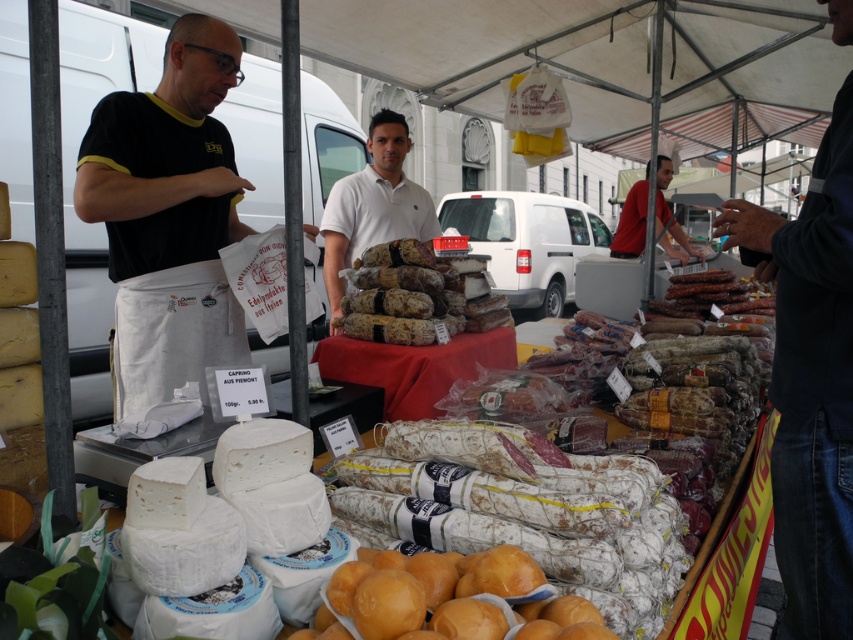
Question: Which of these objects is positioned farthest from the red cotton shirt at upper right?

Choices:
 (A) dark blue shirt at center
 (B) golden matte bread at lower center

Answer: (B)

Question: Which object is farther from the camera taking this photo?

Choices:
 (A) brown textured salami at center
 (B) red cotton shirt at upper right
 (C) red fabric table at center
 (D) golden matte bread at lower center

Answer: (B)

Question: Which point is farther from the camera taking this photo?

Choices:
 (A) (425, 596)
 (B) (390, 404)

Answer: (B)

Question: Is brown textured salami at center positioned in front of red cotton shirt at upper right?

Choices:
 (A) yes
 (B) no

Answer: (A)

Question: Is brown textured salami at center bigger than white cotton shirt at center?

Choices:
 (A) yes
 (B) no

Answer: (B)

Question: Is brown textured salami at center thinner than red cotton shirt at upper right?

Choices:
 (A) yes
 (B) no

Answer: (A)